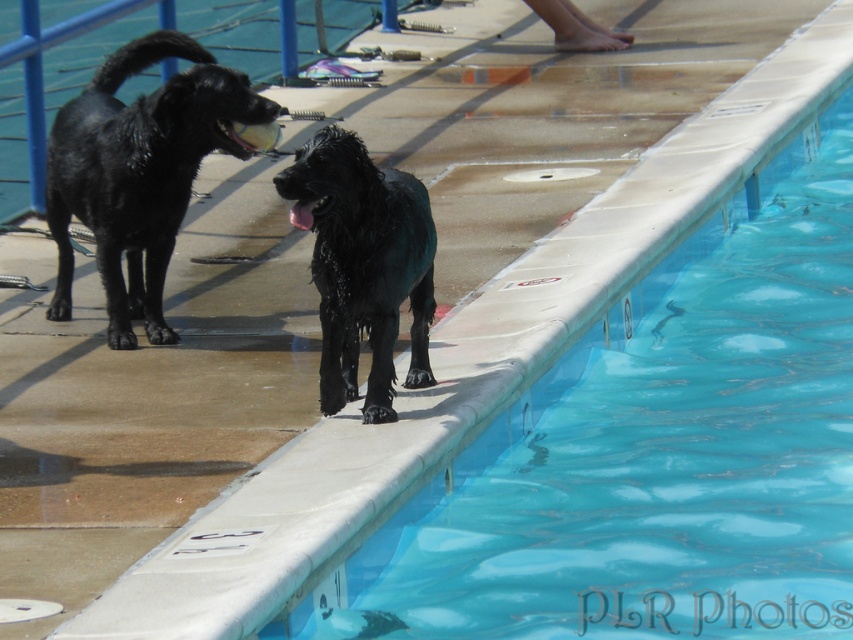
Question: Does smooth concrete edge at upper right appear on the right side of brushed metal rail at left?

Choices:
 (A) no
 (B) yes

Answer: (B)

Question: Which point is closer to the camera taking this photo?

Choices:
 (A) (112, 28)
 (B) (218, 147)
 (C) (389, 628)
 (D) (367, 308)

Answer: (C)

Question: Which point is closer to the camera?

Choices:
 (A) shiny black dog at left
 (B) brushed metal rail at left
 (C) smooth concrete edge at upper right
 (D) wet glossy black dog at center

Answer: (C)

Question: Which point is farther to the camera?

Choices:
 (A) shiny black dog at left
 (B) wet glossy black dog at center
 (C) brushed metal rail at left

Answer: (C)

Question: Is wet glossy black dog at center smaller than brushed metal rail at left?

Choices:
 (A) no
 (B) yes

Answer: (B)

Question: Is smooth concrete edge at upper right above brushed metal rail at left?

Choices:
 (A) no
 (B) yes

Answer: (A)